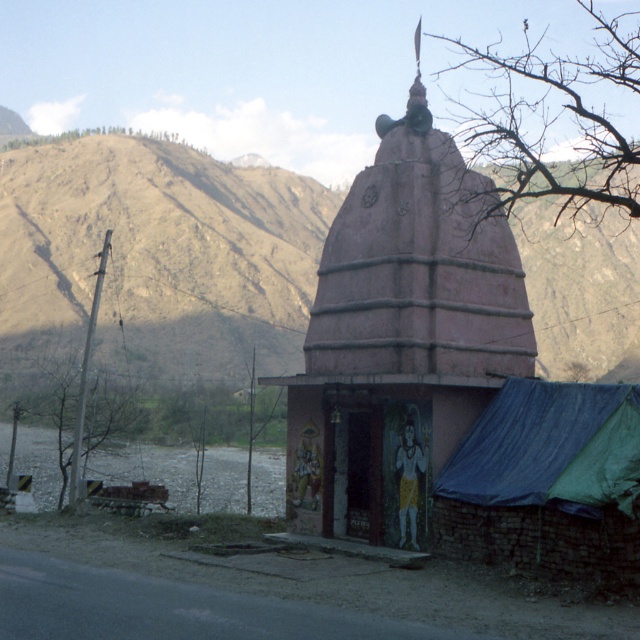
You are standing in front of the temple and want to walk to the gray gravel lake at lower left. Which direction should you move relative to the blue tarpaulin tent at lower right?

You should move away from the blue tarpaulin tent at lower right because the gray gravel lake at lower left is farther from the viewer, so moving away from the tent would lead towards the lake.

You are a photographer planning to capture the pink matte temple at center and the gray gravel lake at lower left in a single frame. Based on their sizes, which object should you focus on first to ensure both fit in the frame?

The pink matte temple at center is thinner than the gray gravel lake at lower left, so you should focus on capturing the gray gravel lake at lower left first since it is wider and requires more space in the frame to ensure both objects fit.